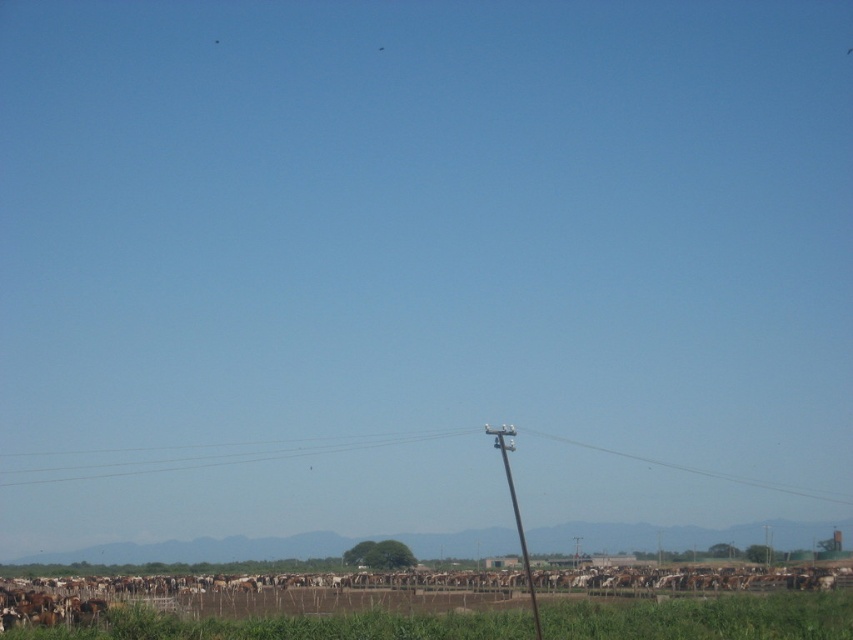
You are a photographer standing at the edge of the water body. You want to capture a photo that includes both the green grass at lower center and the brown wooden telegraph pole at center. Based on their sizes, which object will occupy more space in your photo?

The green grass at lower center will occupy more space in the photo because its width is larger than that of the brown wooden telegraph pole at center.

You are standing at the edge of the water and want to walk towards the brown wooden telegraph pole at center. Which direction should you walk relative to the green grass at lower center?

You should walk to the left of the green grass at lower center because the green grass at lower center is to the right of the brown wooden telegraph pole at center, meaning the pole is located to the left of the grass from your perspective.